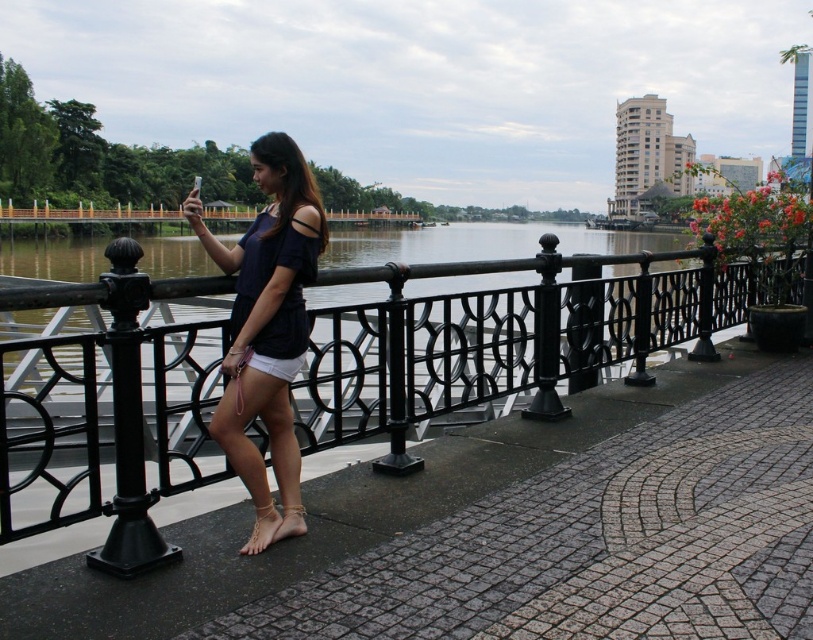
You are a photographer taking a picture of the black wrought iron fence at center and the gold metallic anklet at lower center. Which object will appear closer to the bottom of the photo?

The gold metallic anklet at lower center will appear closer to the bottom of the photo because it is positioned under the black wrought iron fence at center.

You are a painter setting up your easel on the riverside walkway. You want to paint both the black wrought iron fence at center and the matte blue top at center. Which object should you place closer to the edge of your canvas to ensure it fits entirely within the frame?

The black wrought iron fence at center has a smaller width than the matte blue top at center, so you should place the black wrought iron fence at center closer to the edge of your canvas to ensure it fits entirely within the frame.